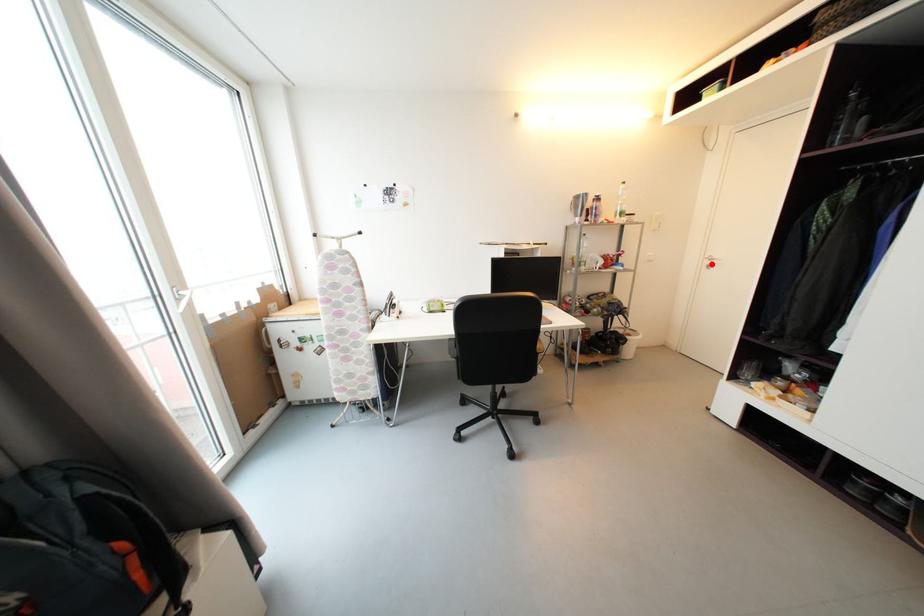
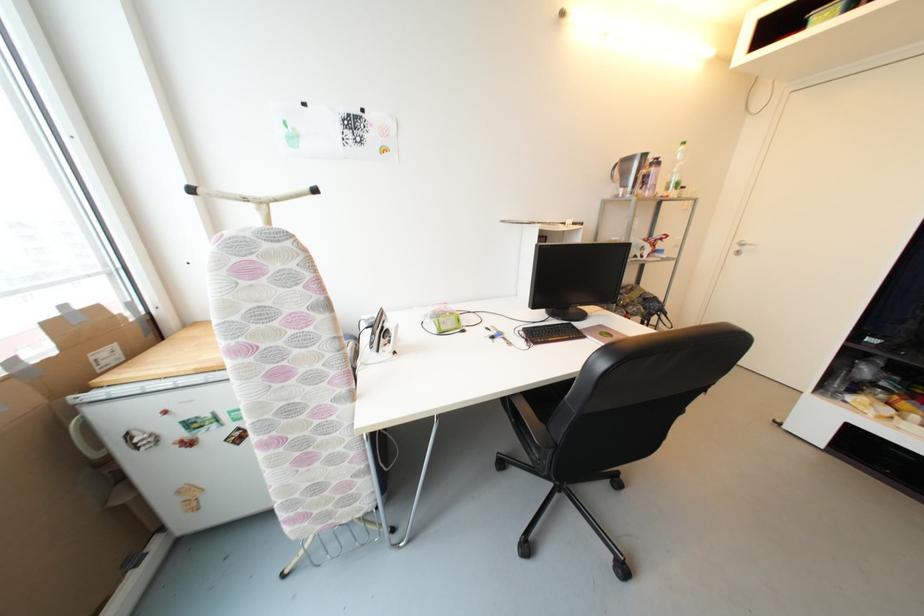
In the second image, find the point that corresponds to the highlighted location in the first image.

(742, 249)